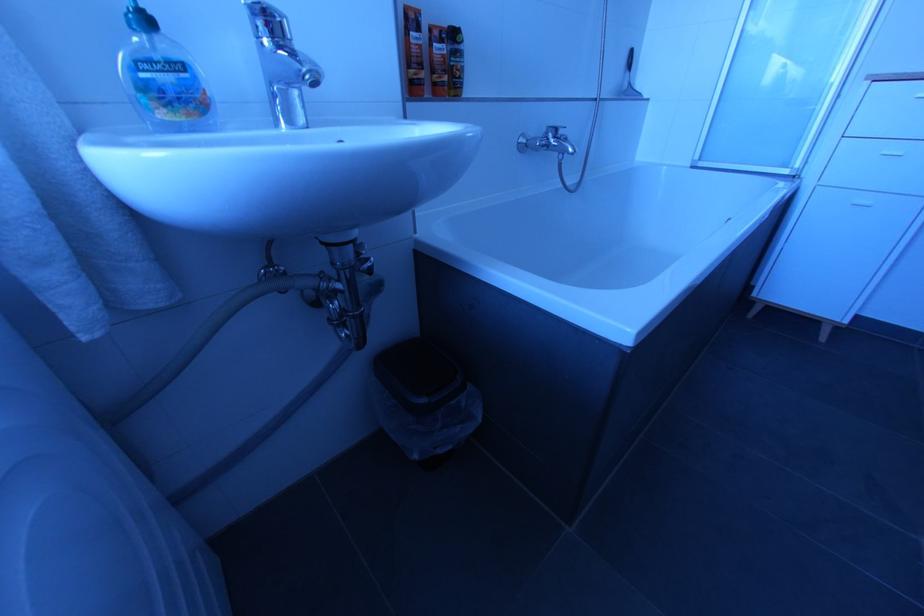
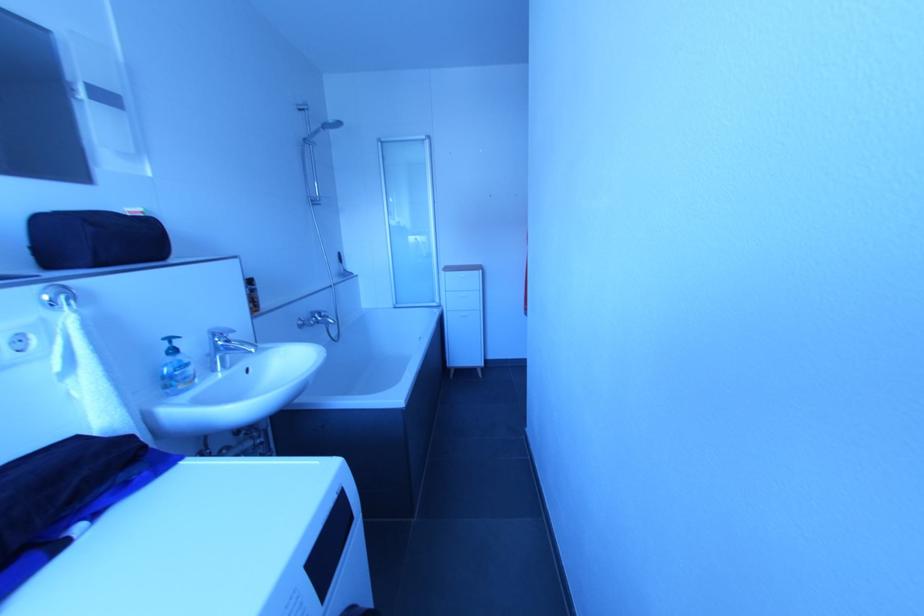
Question: The first image is from the beginning of the video and the second image is from the end. How did the camera likely rotate when shooting the video?

Choices:
 (A) Left
 (B) Right
 (C) Up
 (D) Down

Answer: (B)